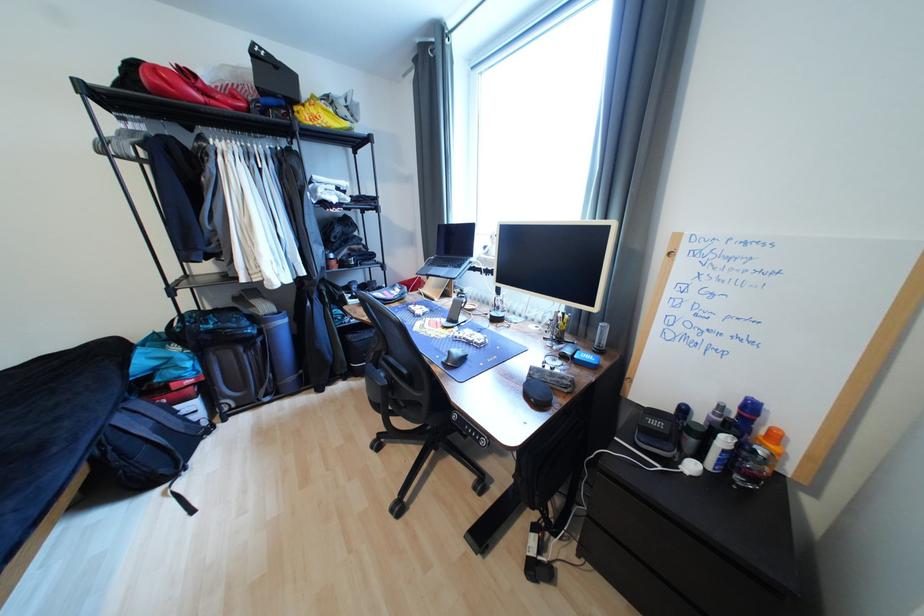
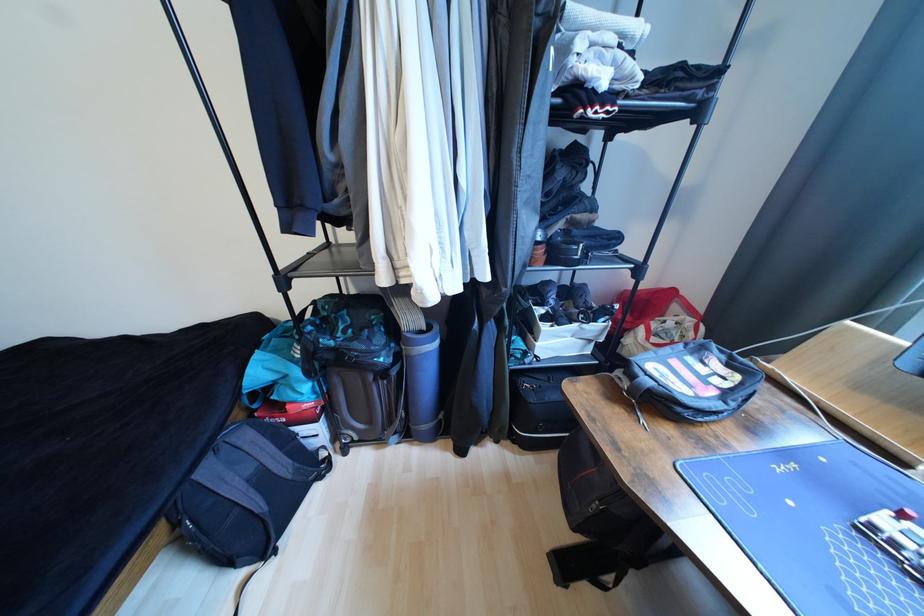
The point at (128, 421) is marked in the first image. Where is the corresponding point in the second image?

(215, 472)